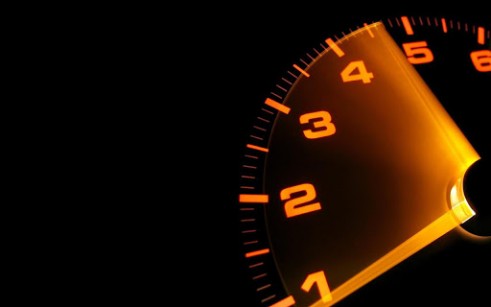
The width and height of the screenshot is (491, 307). I want to click on top left corner empty space, so click(x=7, y=4).